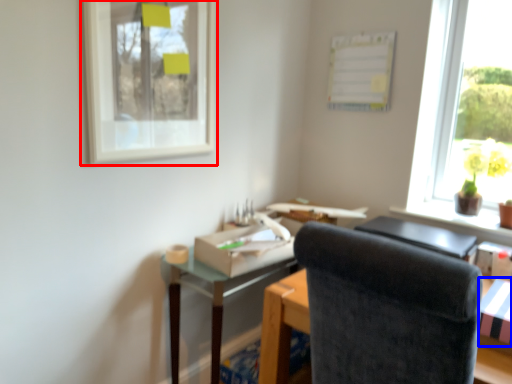
Question: Which object appears farthest to the camera in this image, picture frame (highlighted by a red box) or cardboard box (highlighted by a blue box)?

Choices:
 (A) picture frame
 (B) cardboard box

Answer: (A)